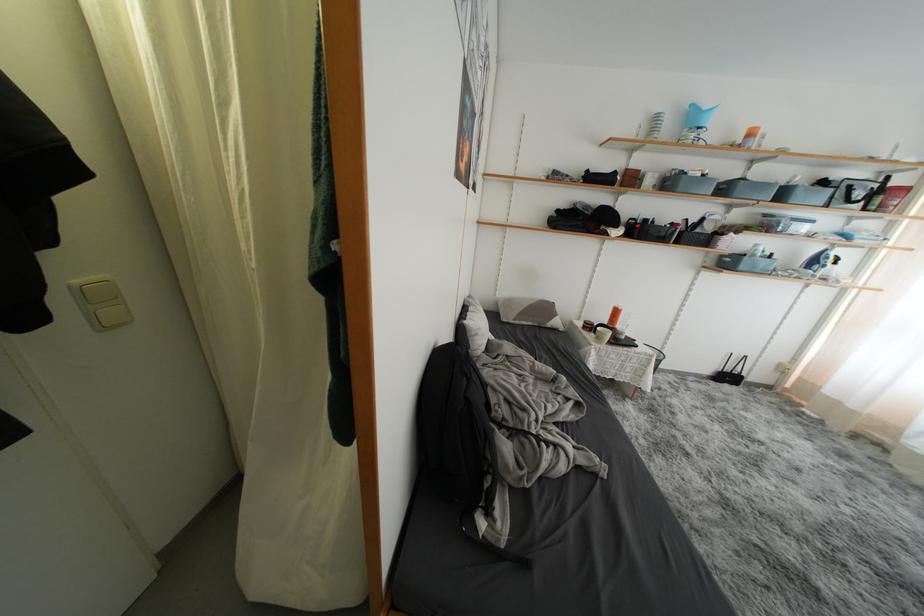
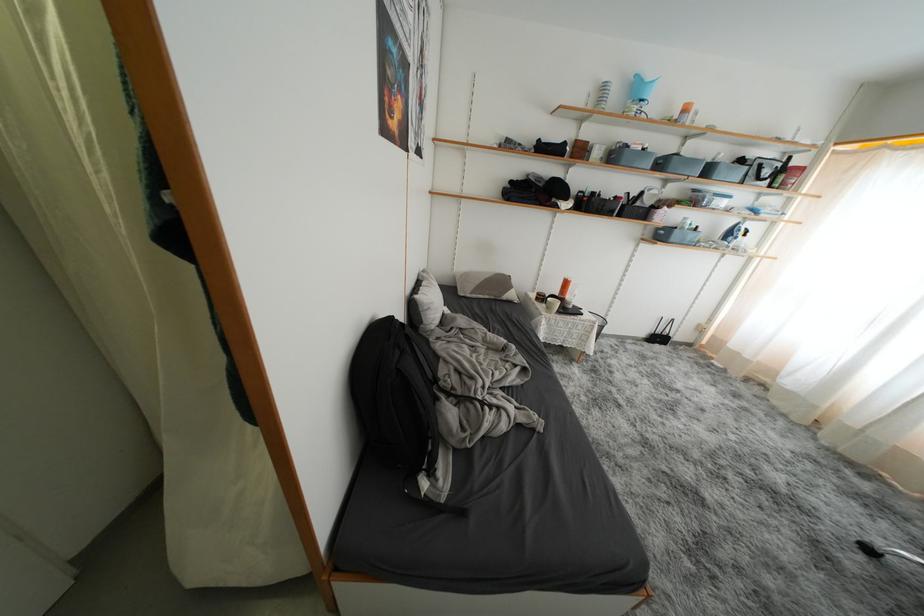
In the second image, find the point that corresponds to [699,124] in the first image.

(642, 97)